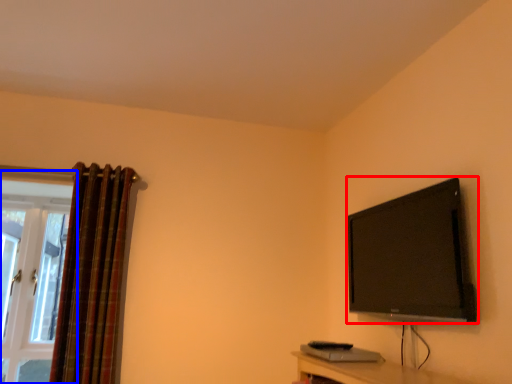
Question: Which object appears closest to the camera in this image, television (highlighted by a red box) or window (highlighted by a blue box)?

Choices:
 (A) television
 (B) window

Answer: (A)